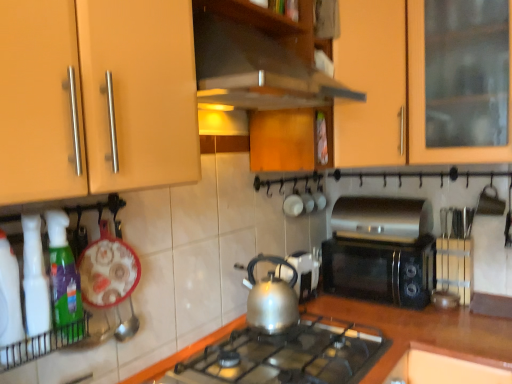
Locate an element on the screen. vacant area located to the right-hand side of silver metallic kettle at center is located at coordinates (335, 302).